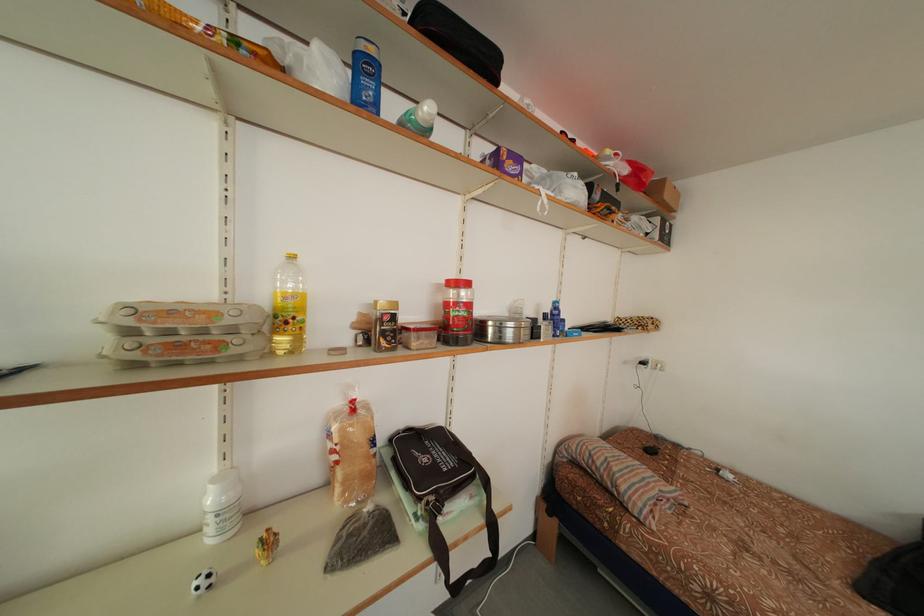
What are the coordinates of `green bottle cap` in the screenshot? It's located at (426, 111).